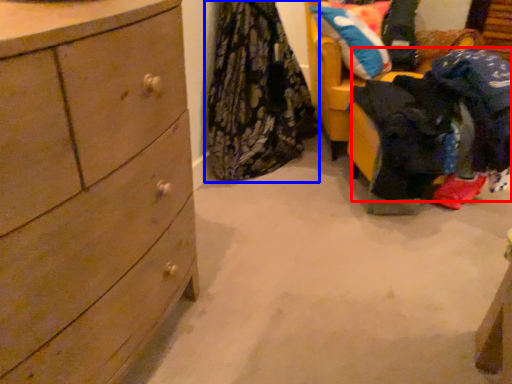
Question: Which of the following is the closest to the observer, clothing (highlighted by a red box) or clothing (highlighted by a blue box)?

Choices:
 (A) clothing
 (B) clothing

Answer: (A)